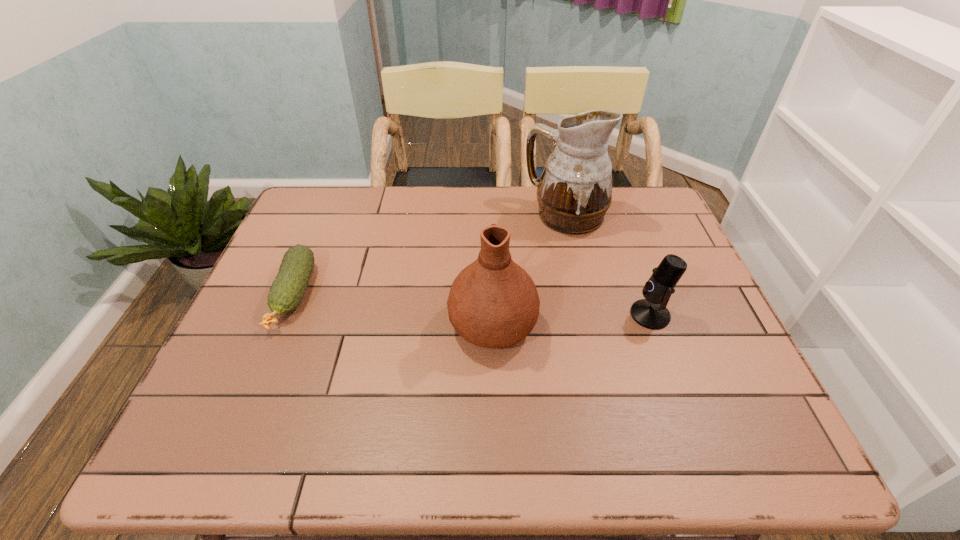
What are the coordinates of `free space located on the side of the nearer pitcher with the handle` in the screenshot? It's located at (491, 235).

You are a GUI agent. You are given a task and a screenshot of the screen. Output one action in this format:
    pyautogui.click(x=<x>, y=<y>)
    Task: Click on the vacant area located on the side of the nearer pitcher with the handle
    
    Given the screenshot: What is the action you would take?
    pyautogui.click(x=491, y=244)

I want to click on free location located on the side of the nearer pitcher with the handle, so click(490, 202).

This screenshot has height=540, width=960. In order to click on vacant area situated on the stand of the second shortest object in this screenshot , I will do `click(602, 315)`.

Image resolution: width=960 pixels, height=540 pixels. Find the location of `vacant area situated 0.140m on the stand of the second shortest object`. vacant area situated 0.140m on the stand of the second shortest object is located at coordinates (573, 315).

You are a GUI agent. You are given a task and a screenshot of the screen. Output one action in this format:
    pyautogui.click(x=<x>, y=<y>)
    Task: Click on the vacant space located on the stand of the second shortest object
    Image resolution: width=960 pixels, height=540 pixels.
    Given the screenshot: What is the action you would take?
    pyautogui.click(x=611, y=315)

I want to click on free location located 0.150m at the blossom end of the cucumber, so click(x=252, y=394).

Where is `object located in the far edge section of the desktop`? The height and width of the screenshot is (540, 960). object located in the far edge section of the desktop is located at coordinates (574, 192).

At what (x,y) coordinates should I click in order to perform the action: click on object that is at the left edge. Please return your answer as a coordinate pair (x, y). The image size is (960, 540). Looking at the image, I should click on (287, 290).

You are a GUI agent. You are given a task and a screenshot of the screen. Output one action in this format:
    pyautogui.click(x=<x>, y=<y>)
    Task: Click on the object that is at the right edge
    
    Given the screenshot: What is the action you would take?
    pyautogui.click(x=651, y=312)